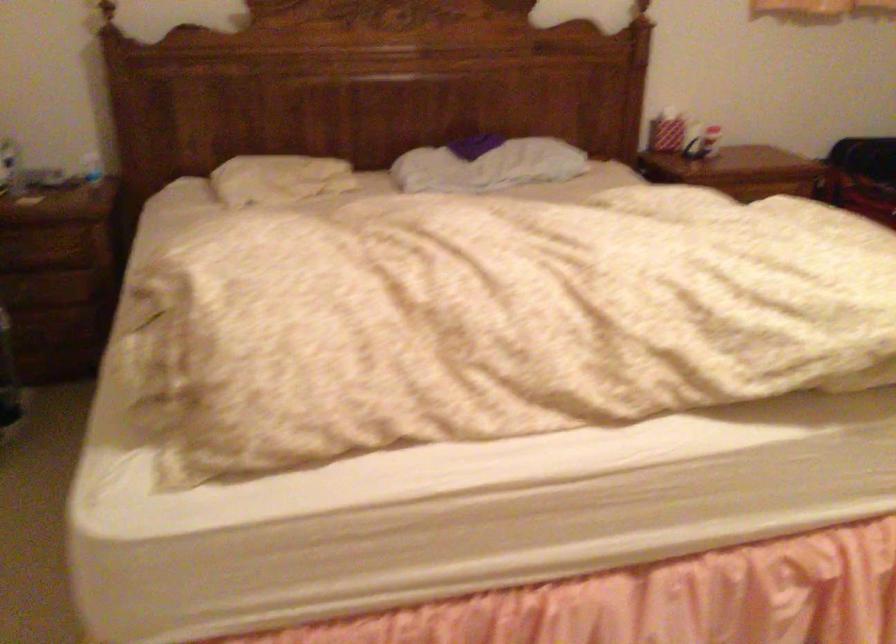
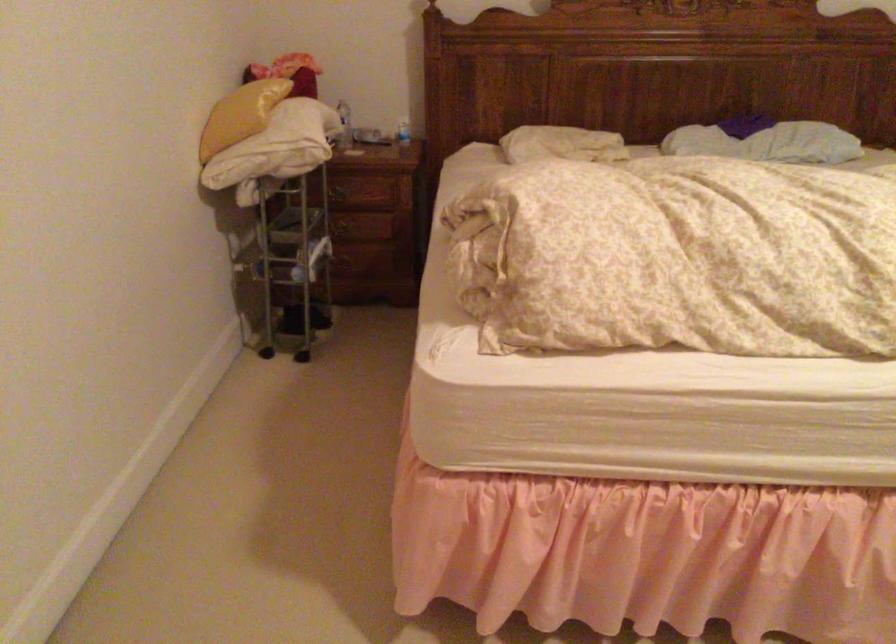
Find the pixel in the second image that matches the point at 487,175 in the first image.

(767, 142)